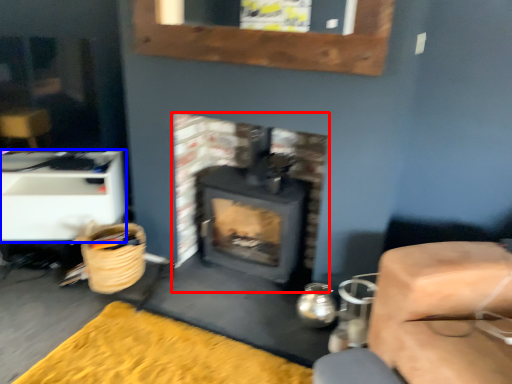
Question: Which point is further to the camera, wood burning stove (highlighted by a red box) or furniture (highlighted by a blue box)?

Choices:
 (A) wood burning stove
 (B) furniture

Answer: (B)